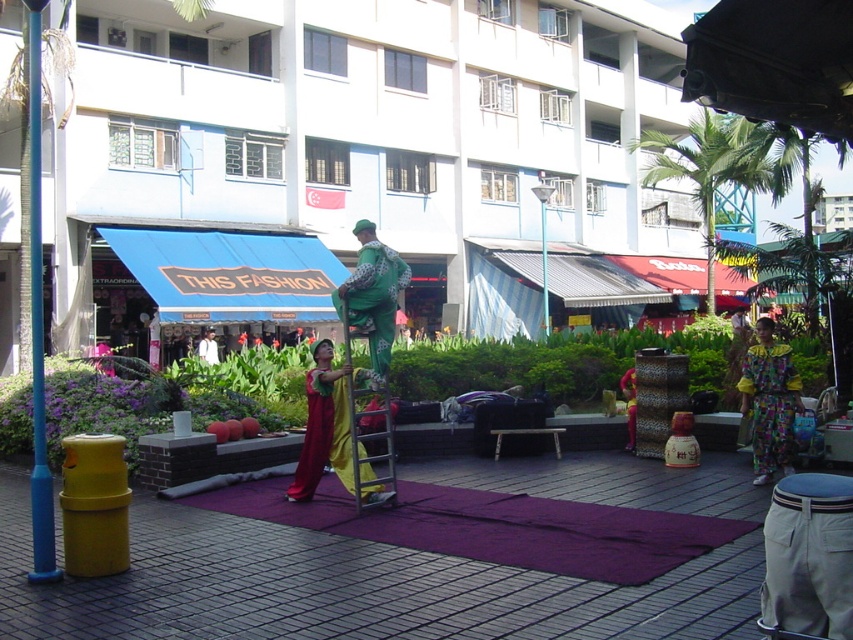
Can you confirm if blue plastic pole at left is shorter than metallic silver ladder at center?

No.

Can you confirm if blue plastic pole at left is positioned above metallic silver ladder at center?

Correct, blue plastic pole at left is located above metallic silver ladder at center.

Does point (53, 545) come closer to viewer compared to point (343, 326)?

That is True.

This screenshot has width=853, height=640. Identify the location of blue plastic pole at left. (38, 321).

How much distance is there between white smooth building at center and metallic silver ladder at center?

white smooth building at center and metallic silver ladder at center are 18.91 meters apart.

How far apart are white smooth building at center and metallic silver ladder at center?

white smooth building at center is 18.91 meters away from metallic silver ladder at center.

Which is in front, point (556, 102) or point (387, 353)?

Point (387, 353)

This screenshot has height=640, width=853. I want to click on white smooth building at center, so click(x=370, y=161).

Does floral fabric dress at lower right appear on the right side of green fabric street artist at center?

Correct, you'll find floral fabric dress at lower right to the right of green fabric street artist at center.

Does floral fabric dress at lower right have a greater height compared to green fabric street artist at center?

Indeed, floral fabric dress at lower right has a greater height compared to green fabric street artist at center.

What do you see at coordinates (769, 401) in the screenshot? I see `floral fabric dress at lower right` at bounding box center [769, 401].

Find the location of a particular element. floral fabric dress at lower right is located at coordinates (769, 401).